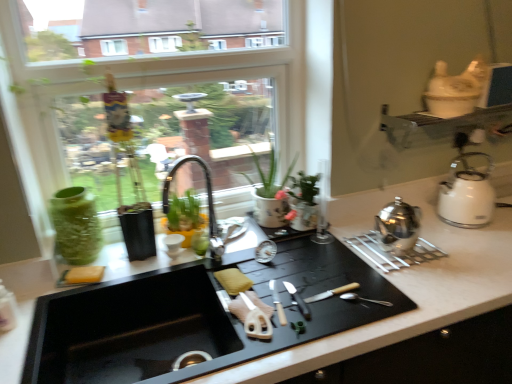
This screenshot has width=512, height=384. Find the location of `free space to the right of silver metallic knife at center, marked as the first knife in a right-to-left arrangement`. free space to the right of silver metallic knife at center, marked as the first knife in a right-to-left arrangement is located at coordinates 355,292.